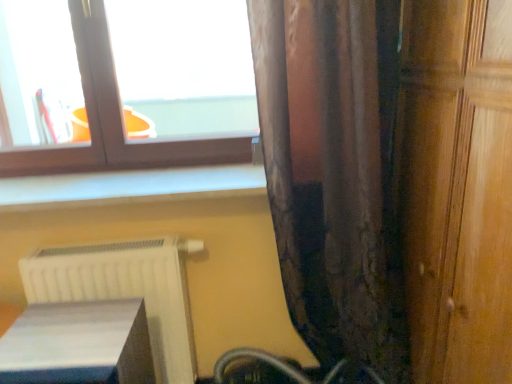
Question: Does white glossy book at lower left touch brown textured curtain at right?

Choices:
 (A) no
 (B) yes

Answer: (A)

Question: Can you confirm if white glossy book at lower left is shorter than brown textured curtain at right?

Choices:
 (A) yes
 (B) no

Answer: (A)

Question: Is white glossy book at lower left positioned far away from brown textured curtain at right?

Choices:
 (A) yes
 (B) no

Answer: (B)

Question: Is white glossy book at lower left looking in the opposite direction of brown textured curtain at right?

Choices:
 (A) yes
 (B) no

Answer: (B)

Question: From a real-world perspective, is white glossy book at lower left over brown textured curtain at right?

Choices:
 (A) no
 (B) yes

Answer: (A)

Question: Is the position of white glossy book at lower left less distant than that of brown textured curtain at right?

Choices:
 (A) yes
 (B) no

Answer: (A)

Question: Does white matte radiator at lower left have a lesser height compared to matte brown window at upper left?

Choices:
 (A) yes
 (B) no

Answer: (B)

Question: Is white matte radiator at lower left positioned far away from matte brown window at upper left?

Choices:
 (A) yes
 (B) no

Answer: (B)

Question: Is white matte radiator at lower left bigger than matte brown window at upper left?

Choices:
 (A) yes
 (B) no

Answer: (B)

Question: Is white matte radiator at lower left not inside matte brown window at upper left?

Choices:
 (A) yes
 (B) no

Answer: (A)

Question: Does white matte radiator at lower left have a greater width compared to matte brown window at upper left?

Choices:
 (A) no
 (B) yes

Answer: (B)

Question: Is white matte radiator at lower left looking in the opposite direction of matte brown window at upper left?

Choices:
 (A) no
 (B) yes

Answer: (A)

Question: Considering the relative positions of wooden door at right and white glossy book at lower left in the image provided, is wooden door at right behind white glossy book at lower left?

Choices:
 (A) no
 (B) yes

Answer: (A)